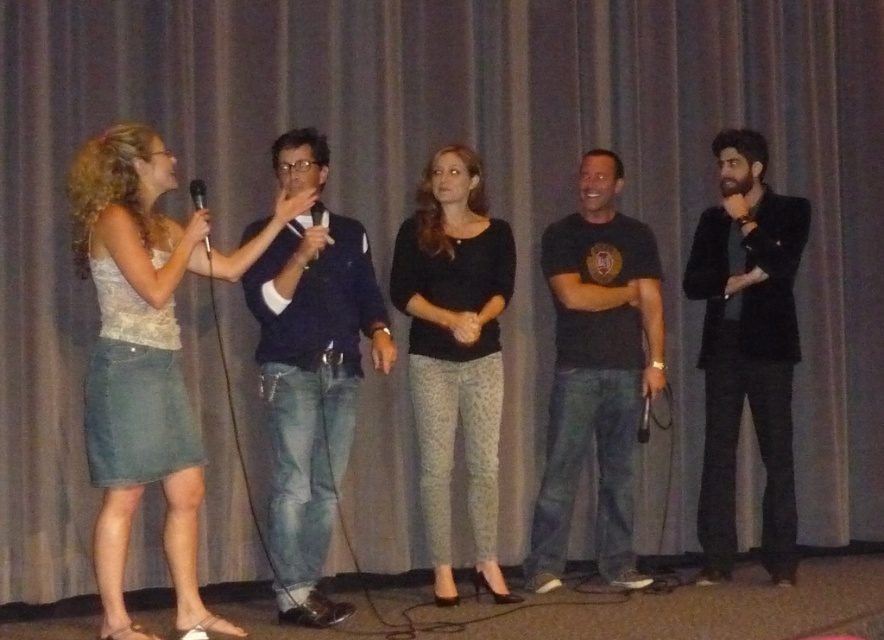
You are an event photographer trying to capture a clear shot of the black matte microphone at center during the presentation. However, the dark blue denim jeans at center are blocking your view. Can you adjust your position to see the microphone?

The dark blue denim jeans at center is in front of the black matte microphone at center, so moving your position to the side or behind the jeans would allow you to see the microphone.

You are a stagehand setting up for a presentation. You need to place a black matte microphone at center and dark blue denim jeans at center on a table. The table has limited space. Which object should you place first to ensure both fit?

The dark blue denim jeans at center should be placed first because it is larger in size than the black matte microphone at center, ensuring there is enough space for both on the table.

You are sitting in the audience and want to know which of the two points, point [565,285] or point [753,275], is closer to you. Based on the image, which point is nearer?

Point [565,285] is further to the camera than point [753,275]. Therefore, point [753,275] is closer to you.